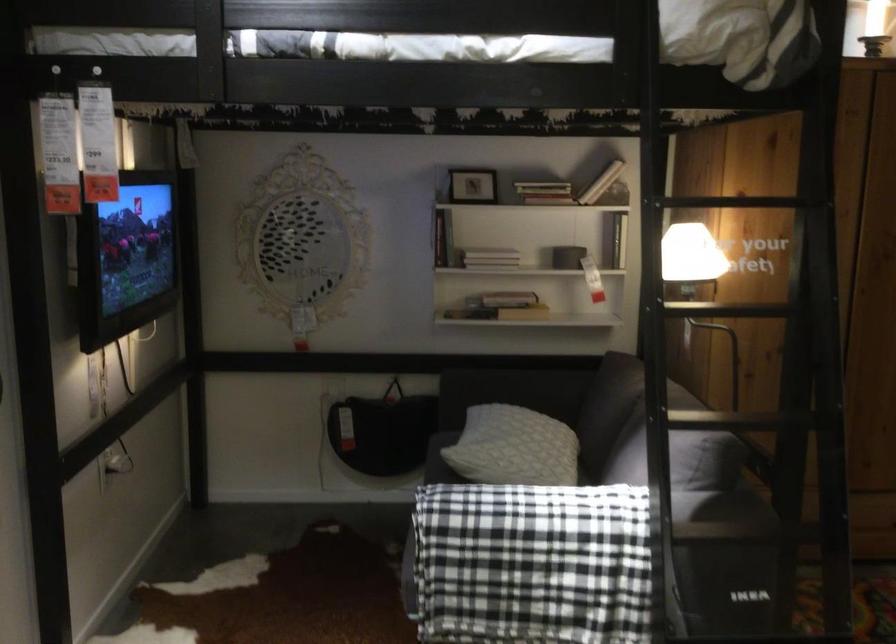
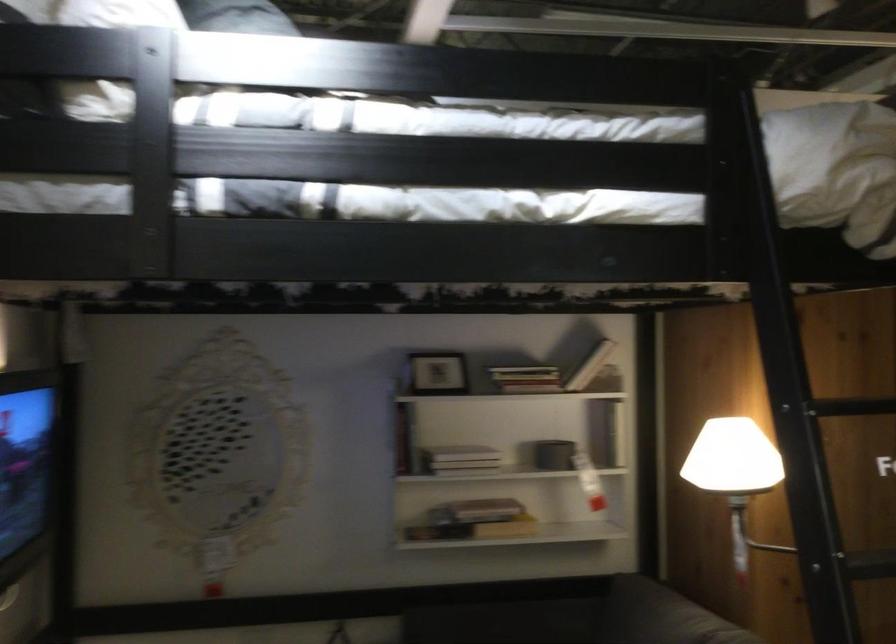
Locate, in the second image, the point that corresponds to point (602, 173) in the first image.

(590, 366)